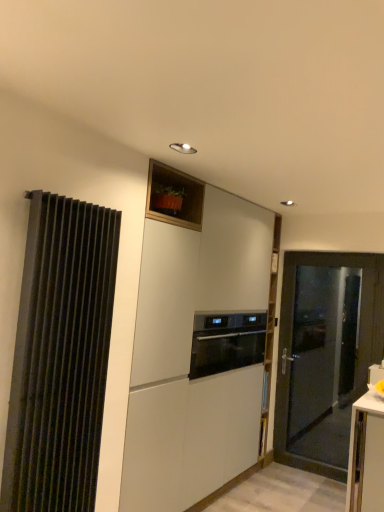
Question: From a real-world perspective, is black glass oven at center beneath black ribbed curtain at left?

Choices:
 (A) no
 (B) yes

Answer: (B)

Question: Is black ribbed curtain at left at the back of black glass oven at center?

Choices:
 (A) no
 (B) yes

Answer: (A)

Question: From the image's perspective, is black glass oven at center above black ribbed curtain at left?

Choices:
 (A) no
 (B) yes

Answer: (A)

Question: From a real-world perspective, is black glass oven at center positioned over black ribbed curtain at left based on gravity?

Choices:
 (A) no
 (B) yes

Answer: (A)

Question: Considering the relative sizes of black glass oven at center and black ribbed curtain at left in the image provided, is black glass oven at center taller than black ribbed curtain at left?

Choices:
 (A) yes
 (B) no

Answer: (B)

Question: Is black ribbed curtain at left completely or partially inside black glass oven at center?

Choices:
 (A) yes
 (B) no

Answer: (B)

Question: Is white matte cabinet at center not within black glass oven at center?

Choices:
 (A) yes
 (B) no

Answer: (A)

Question: Would you say white matte cabinet at center contains black glass oven at center?

Choices:
 (A) yes
 (B) no

Answer: (A)

Question: Does white matte cabinet at center have a greater height compared to black glass oven at center?

Choices:
 (A) yes
 (B) no

Answer: (A)

Question: Is white matte cabinet at center with black glass oven at center?

Choices:
 (A) yes
 (B) no

Answer: (B)

Question: From a real-world perspective, is white matte cabinet at center on top of black glass oven at center?

Choices:
 (A) yes
 (B) no

Answer: (B)

Question: From a real-world perspective, is white matte cabinet at center below black glass oven at center?

Choices:
 (A) no
 (B) yes

Answer: (B)

Question: Considering the relative positions of white matte cabinet at center and matte black door at right in the image provided, is white matte cabinet at center to the left of matte black door at right from the viewer's perspective?

Choices:
 (A) no
 (B) yes

Answer: (B)